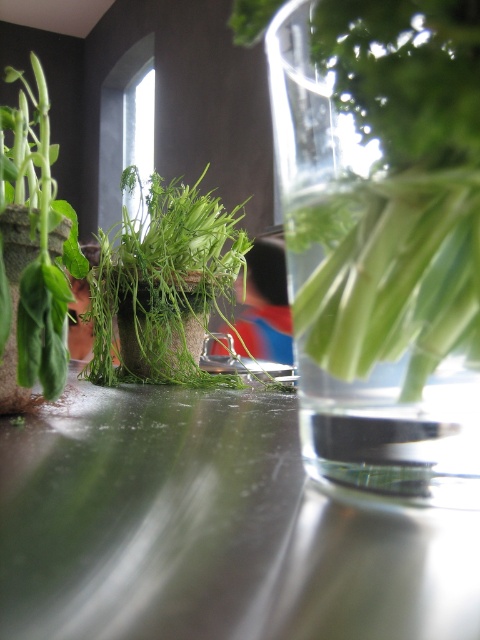
From the picture: You are a photographer adjusting your camera focus. You notice two points in the image at coordinates point (387, 433) and point (159, 371). Which point should you focus on first to ensure both are in focus?

Point (387, 433) is closer to the camera than point (159, 371). To ensure both points are in focus, you should focus on the closer point first, which is point (387, 433).

You are standing in front of the kitchen countertop with the plants. You want to place a small object on the countertop. Which of the two points, point (38, 340) or point (25, 250), is closer to you?

Point (38, 340) is closer to the viewer than point (25, 250).

You are arranging plants on a kitchen counter and see the green matte plant at left and the green matte plant pot at left. Which one is positioned more to the left?

The green matte plant at left is positioned more to the left than the green matte plant pot at left.